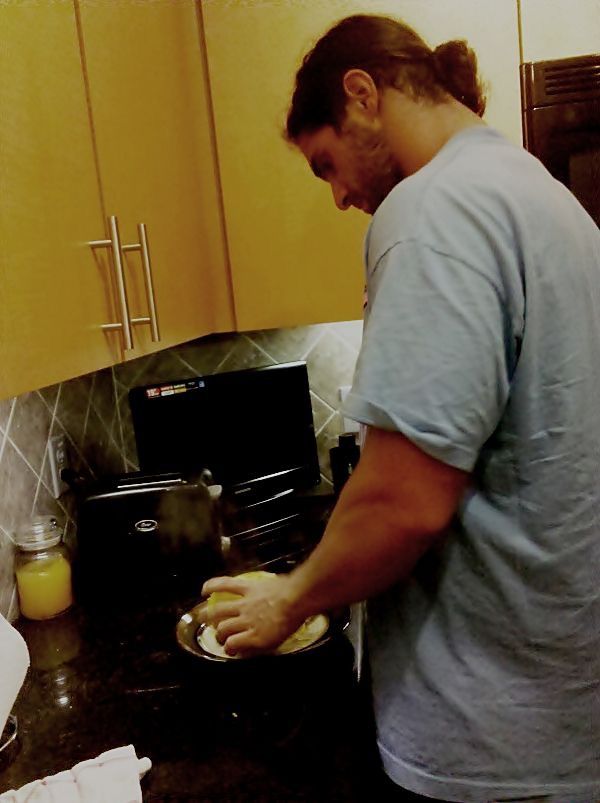
Identify the location of grey wall. Image resolution: width=600 pixels, height=803 pixels. (12, 507).